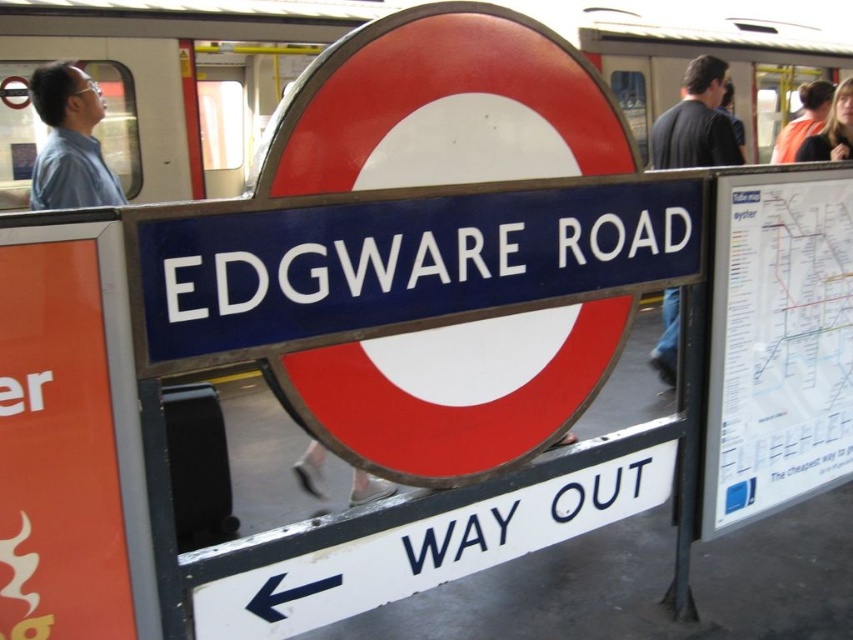
Question: Which object is the farthest from the metallic blue sign at center?

Choices:
 (A) white painted metal sign at lower center
 (B) orange safety vest at upper right
 (C) orange shirt at upper right
 (D) matte blue shirt at upper left

Answer: (C)

Question: Is black shirt at right below orange safety vest at upper right?

Choices:
 (A) yes
 (B) no

Answer: (B)

Question: Is black shirt at right to the left of orange shirt at upper right from the viewer's perspective?

Choices:
 (A) yes
 (B) no

Answer: (A)

Question: Which object is positioned farthest from the orange shirt at upper right?

Choices:
 (A) matte blue shirt at upper left
 (B) metallic blue sign at center
 (C) white painted metal sign at lower center
 (D) orange safety vest at upper right

Answer: (A)

Question: Is metallic blue sign at center bigger than black shirt at right?

Choices:
 (A) no
 (B) yes

Answer: (B)

Question: Among these objects, which one is farthest from the camera?

Choices:
 (A) matte blue shirt at upper left
 (B) white painted metal sign at lower center
 (C) orange safety vest at upper right

Answer: (C)